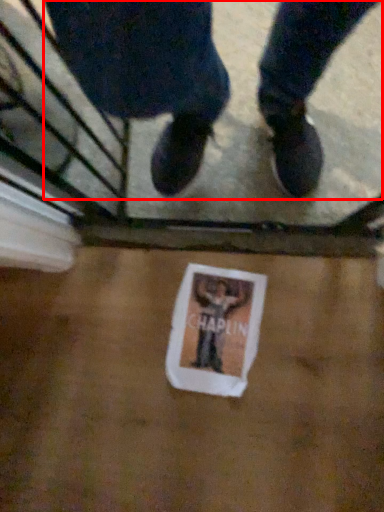
Question: From the image's perspective, where is person (annotated by the red box) located relative to flyer?

Choices:
 (A) above
 (B) below

Answer: (A)